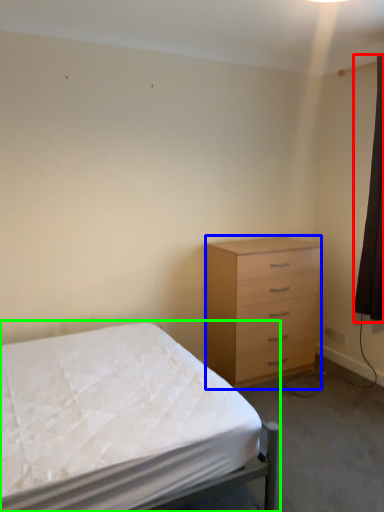
Question: Based on their relative distances, which object is farther from curtain (highlighted by a red box)? Choose from chest of drawers (highlighted by a blue box) and bed (highlighted by a green box).

Choices:
 (A) chest of drawers
 (B) bed

Answer: (B)